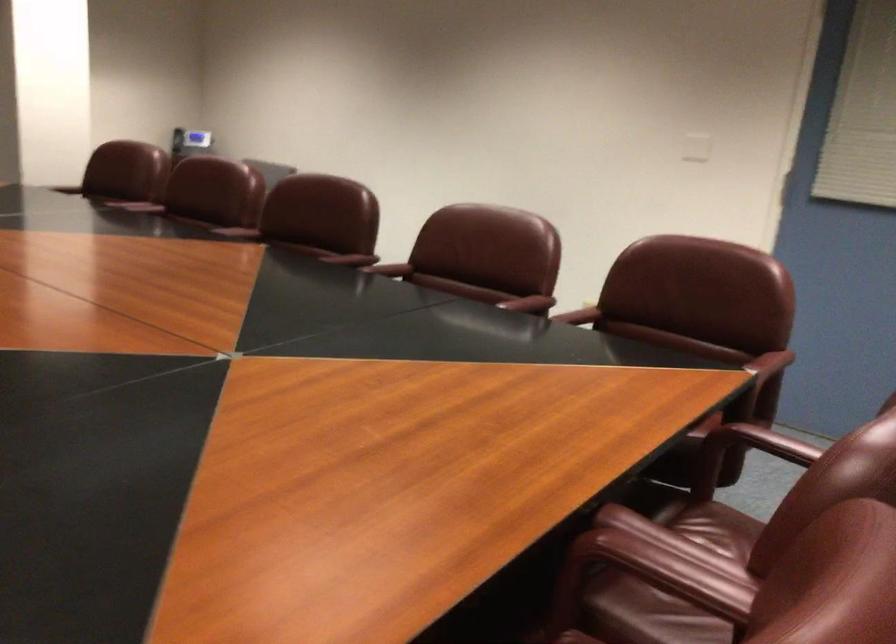
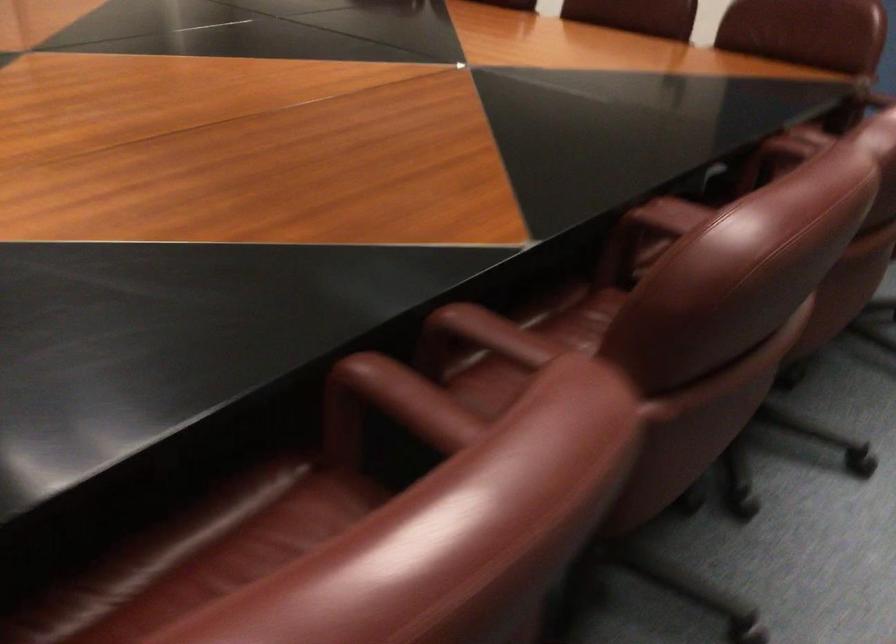
In the second image, find the point that corresponds to (337,252) in the first image.

(493, 334)